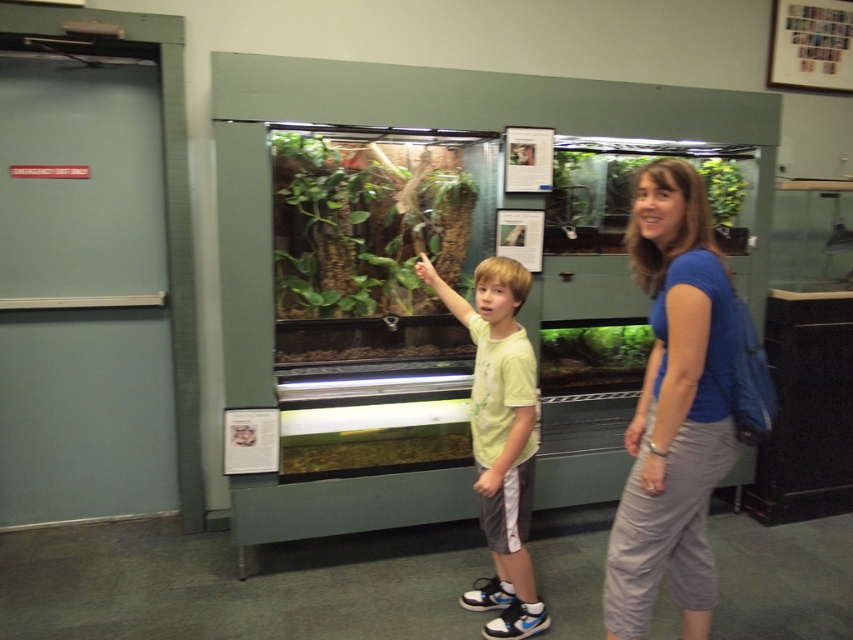
Who is shorter, blue fabric backpack at center-right or yellow matte shirt at center?

yellow matte shirt at center

Is point (647, 563) in front of point (515, 288)?

That is True.

You are a GUI agent. You are given a task and a screenshot of the screen. Output one action in this format:
    pyautogui.click(x=<x>, y=<y>)
    Task: Click on the blue fabric backpack at center-right
    Image resolution: width=853 pixels, height=640 pixels.
    Given the screenshot: What is the action you would take?
    pyautogui.click(x=672, y=410)